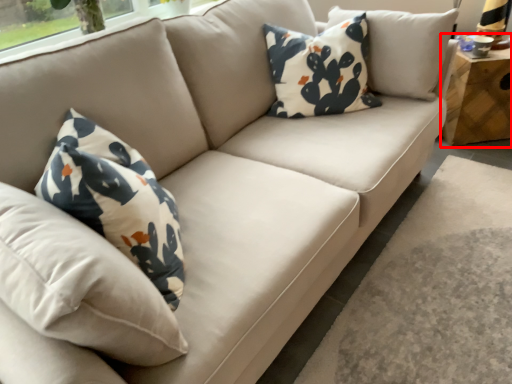
Question: Observing the image, what is the correct spatial positioning of table (annotated by the red box) in reference to pillow?

Choices:
 (A) left
 (B) right

Answer: (B)